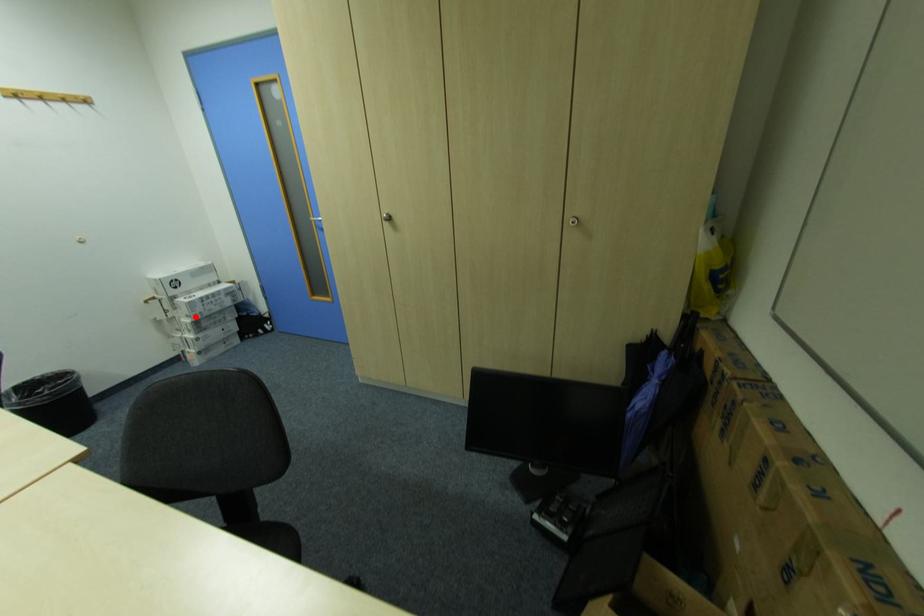
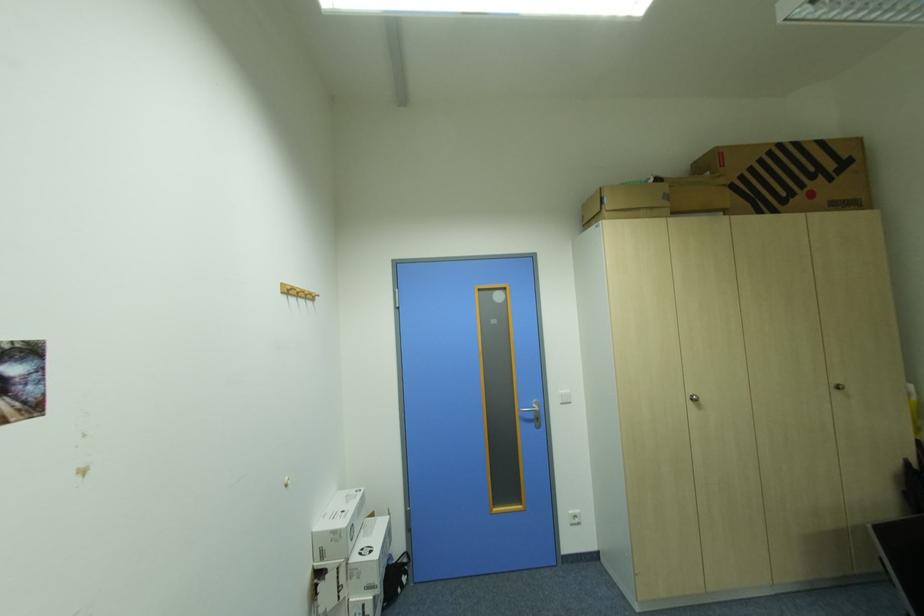
Find the pixel in the second image that matches the highlighted location in the first image.

(377, 590)